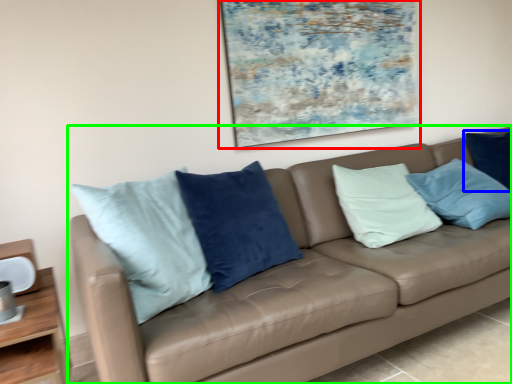
Question: Estimate the real-world distances between objects in this image. Which object is farther from picture frame (highlighted by a red box), pillow (highlighted by a blue box) or studio couch (highlighted by a green box)?

Choices:
 (A) pillow
 (B) studio couch

Answer: (A)